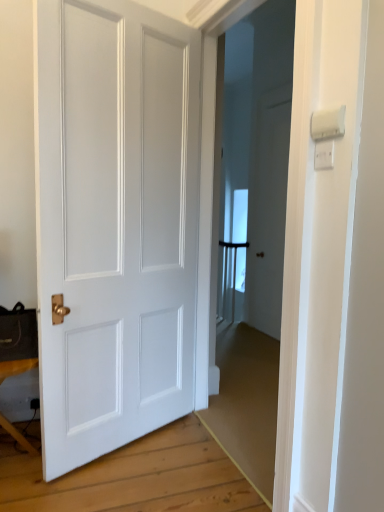
This screenshot has width=384, height=512. Describe the element at coordinates (115, 224) in the screenshot. I see `white matte door at center` at that location.

The width and height of the screenshot is (384, 512). Find the location of `white plastic light switch at upper right, placed as the second light switch when sorted from bottom to top`. white plastic light switch at upper right, placed as the second light switch when sorted from bottom to top is located at coordinates (328, 123).

Locate an element on the screen. The image size is (384, 512). white plastic light switch at upper right, which is the second light switch in top-to-bottom order is located at coordinates tap(324, 155).

Identify the location of white matte door at center. (115, 224).

Which of these two, wooden table at lower left or white plastic light switch at upper right, the first light switch in the bottom-to-top sequence, is smaller?

white plastic light switch at upper right, the first light switch in the bottom-to-top sequence.

Are wooden table at lower left and white plastic light switch at upper right, the first light switch in the bottom-to-top sequence, located far from each other?

That's right, there is a large distance between wooden table at lower left and white plastic light switch at upper right, the first light switch in the bottom-to-top sequence.

Considering the relative sizes of wooden table at lower left and white plastic light switch at upper right, which is the second light switch in top-to-bottom order, in the image provided, is wooden table at lower left wider than white plastic light switch at upper right, which is the second light switch in top-to-bottom order,?

Correct, the width of wooden table at lower left exceeds that of white plastic light switch at upper right, which is the second light switch in top-to-bottom order.

Is wooden table at lower left positioned in front of white plastic light switch at upper right, the first light switch in the bottom-to-top sequence?

No, wooden table at lower left is further to the viewer.

In terms of height, does white plastic light switch at upper right, placed as the second light switch when sorted from bottom to top, look taller or shorter compared to white matte door at center?

In the image, white plastic light switch at upper right, placed as the second light switch when sorted from bottom to top, appears to be shorter than white matte door at center.

Based on the photo, is there a large distance between white plastic light switch at upper right, placed as the second light switch when sorted from bottom to top, and white matte door at center?

Absolutely, white plastic light switch at upper right, placed as the second light switch when sorted from bottom to top, is distant from white matte door at center.

In terms of size, does white plastic light switch at upper right, which is the first light switch from top to bottom, appear bigger or smaller than white matte door at center?

white plastic light switch at upper right, which is the first light switch from top to bottom, is smaller than white matte door at center.

In the scene shown: Can you confirm if white matte door at center is taller than wooden table at lower left?

Indeed, white matte door at center has a greater height compared to wooden table at lower left.

Is point (170, 379) positioned in front of point (32, 358)?

No, it is behind (32, 358).

From a real-world perspective, is white matte door at center physically located above or below wooden table at lower left?

white matte door at center is above wooden table at lower left.

Is white matte door at center to the right of wooden table at lower left from the viewer's perspective?

Yes.

Where is `table that appears behind the white plastic light switch at upper right, which is the second light switch in top-to-bottom order`? The height and width of the screenshot is (512, 384). table that appears behind the white plastic light switch at upper right, which is the second light switch in top-to-bottom order is located at coordinates (16, 367).

Between white plastic light switch at upper right, which is the second light switch in top-to-bottom order, and wooden table at lower left, which one appears on the right side from the viewer's perspective?

Positioned to the right is white plastic light switch at upper right, which is the second light switch in top-to-bottom order.

Is white plastic light switch at upper right, the first light switch in the bottom-to-top sequence, far away from wooden table at lower left?

Yes, white plastic light switch at upper right, the first light switch in the bottom-to-top sequence, is far from wooden table at lower left.

From the image's perspective, is white plastic light switch at upper right, the first light switch in the bottom-to-top sequence, under white plastic light switch at upper right, which is the first light switch from top to bottom?

Yes.

Is point (329, 154) farther from camera compared to point (315, 136)?

No, (329, 154) is closer to viewer.

From a real-world perspective, is white plastic light switch at upper right, which is the second light switch in top-to-bottom order, on white plastic light switch at upper right, placed as the second light switch when sorted from bottom to top?

No, from a real-world perspective, white plastic light switch at upper right, which is the second light switch in top-to-bottom order, is not on top of white plastic light switch at upper right, placed as the second light switch when sorted from bottom to top.

Does point (154, 29) appear closer or farther from the camera than point (321, 149)?

Point (154, 29) appears to be farther away from the viewer than point (321, 149).

Is white matte door at center positioned with its back to white plastic light switch at upper right, which is the second light switch in top-to-bottom order?

Yes.

Considering the sizes of objects white matte door at center and white plastic light switch at upper right, the first light switch in the bottom-to-top sequence, in the image provided, who is bigger, white matte door at center or white plastic light switch at upper right, the first light switch in the bottom-to-top sequence,?

Bigger between the two is white matte door at center.

Which of these two, white matte door at center or white plastic light switch at upper right, which is the second light switch in top-to-bottom order, is wider?

Wider between the two is white matte door at center.

Is white plastic light switch at upper right, placed as the second light switch when sorted from bottom to top, wider or thinner than white plastic light switch at upper right, which is the second light switch in top-to-bottom order?

Clearly, white plastic light switch at upper right, placed as the second light switch when sorted from bottom to top, has more width compared to white plastic light switch at upper right, which is the second light switch in top-to-bottom order.

Is white plastic light switch at upper right, the first light switch in the bottom-to-top sequence, surrounded by white plastic light switch at upper right, placed as the second light switch when sorted from bottom to top?

Actually, white plastic light switch at upper right, the first light switch in the bottom-to-top sequence, is outside white plastic light switch at upper right, placed as the second light switch when sorted from bottom to top.

Can you confirm if white plastic light switch at upper right, placed as the second light switch when sorted from bottom to top, is taller than white plastic light switch at upper right, which is the second light switch in top-to-bottom order?

Yes, white plastic light switch at upper right, placed as the second light switch when sorted from bottom to top, is taller than white plastic light switch at upper right, which is the second light switch in top-to-bottom order.

From a real-world perspective, which object rests below the other?

From a 3D spatial view, white plastic light switch at upper right, which is the second light switch in top-to-bottom order, is below.

From a real-world perspective, which light switch is the 1st one above the wooden table at lower left? Please provide its 2D coordinates.

[(324, 155)]

In order to click on the 2nd light switch in front of the white matte door at center, starting your count from the anchor in this screenshot , I will do `click(328, 123)`.

Considering their positions, is wooden table at lower left positioned closer to white plastic light switch at upper right, which is the second light switch in top-to-bottom order, than white matte door at center?

Based on the image, white matte door at center appears to be nearer to white plastic light switch at upper right, which is the second light switch in top-to-bottom order.

Estimate the real-world distances between objects in this image. Which object is closer to wooden table at lower left, white matte door at center or white plastic light switch at upper right, which is the first light switch from top to bottom?

Among the two, white matte door at center is located nearer to wooden table at lower left.

Estimate the real-world distances between objects in this image. Which object is further from white plastic light switch at upper right, placed as the second light switch when sorted from bottom to top, wooden table at lower left or white plastic light switch at upper right, which is the second light switch in top-to-bottom order?

Based on the image, wooden table at lower left appears to be further to white plastic light switch at upper right, placed as the second light switch when sorted from bottom to top.

When comparing their distances from wooden table at lower left, does white matte door at center or white plastic light switch at upper right, the first light switch in the bottom-to-top sequence, seem closer?

The object closer to wooden table at lower left is white matte door at center.

Based on the photo, when comparing their distances from white matte door at center, does wooden table at lower left or white plastic light switch at upper right, which is the second light switch in top-to-bottom order, seem further?

The object further to white matte door at center is white plastic light switch at upper right, which is the second light switch in top-to-bottom order.

Which object lies nearer to the anchor point white matte door at center, white plastic light switch at upper right, which is the second light switch in top-to-bottom order, or white plastic light switch at upper right, placed as the second light switch when sorted from bottom to top?

white plastic light switch at upper right, which is the second light switch in top-to-bottom order, lies closer to white matte door at center than the other object.

Looking at the image, which one is located closer to white plastic light switch at upper right, which is the first light switch from top to bottom, white plastic light switch at upper right, the first light switch in the bottom-to-top sequence, or wooden table at lower left?

white plastic light switch at upper right, the first light switch in the bottom-to-top sequence.

Considering their positions, is wooden table at lower left positioned further to white plastic light switch at upper right, which is the second light switch in top-to-bottom order, than white plastic light switch at upper right, placed as the second light switch when sorted from bottom to top?

wooden table at lower left lies further to white plastic light switch at upper right, which is the second light switch in top-to-bottom order, than the other object.

You are a GUI agent. You are given a task and a screenshot of the screen. Output one action in this format:
    pyautogui.click(x=<x>, y=<y>)
    Task: Click on the light switch situated between wooden table at lower left and white plastic light switch at upper right, the first light switch in the bottom-to-top sequence, from left to right
    This screenshot has width=384, height=512.
    Given the screenshot: What is the action you would take?
    pyautogui.click(x=328, y=123)

At what (x,y) coordinates should I click in order to perform the action: click on door located between wooden table at lower left and white plastic light switch at upper right, the first light switch in the bottom-to-top sequence, in the left-right direction. Please return your answer as a coordinate pair (x, y). Looking at the image, I should click on (115, 224).

Identify the location of door between wooden table at lower left and white plastic light switch at upper right, which is the first light switch from top to bottom, from left to right. The width and height of the screenshot is (384, 512). (115, 224).

The image size is (384, 512). Find the location of `light switch situated between white matte door at center and white plastic light switch at upper right, the first light switch in the bottom-to-top sequence, from left to right`. light switch situated between white matte door at center and white plastic light switch at upper right, the first light switch in the bottom-to-top sequence, from left to right is located at coordinates (328, 123).